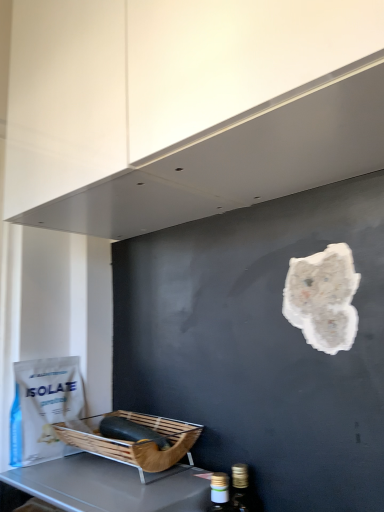
Question: Is white matte exhaust hood at upper center inside the boundaries of wooden basket at lower left, or outside?

Choices:
 (A) outside
 (B) inside

Answer: (A)

Question: From their relative heights in the image, would you say white matte exhaust hood at upper center is taller or shorter than wooden basket at lower left?

Choices:
 (A) short
 (B) tall

Answer: (B)

Question: Which object is positioned closest to the white matte paper bag at lower left?

Choices:
 (A) white matte exhaust hood at upper center
 (B) brown woven basket at lower left
 (C) wooden basket at lower left

Answer: (B)

Question: Which object is the farthest from the white matte paper bag at lower left?

Choices:
 (A) wooden basket at lower left
 (B) white matte exhaust hood at upper center
 (C) brown woven basket at lower left

Answer: (B)